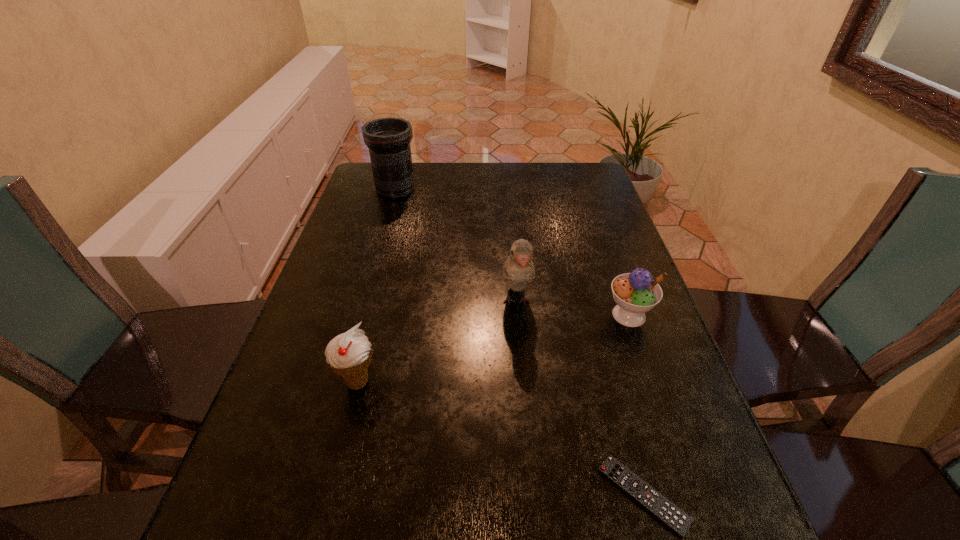
Where is `free space at the left edge of the desktop`? free space at the left edge of the desktop is located at coordinates (297, 379).

You are a GUI agent. You are given a task and a screenshot of the screen. Output one action in this format:
    pyautogui.click(x=<x>, y=<y>)
    Task: Click on the free space at the right edge
    This screenshot has height=540, width=960.
    Given the screenshot: What is the action you would take?
    [x=704, y=534]

The height and width of the screenshot is (540, 960). I want to click on free area in between the farthest object and the remote control, so click(519, 342).

You are a GUI agent. You are given a task and a screenshot of the screen. Output one action in this format:
    pyautogui.click(x=<x>, y=<y>)
    Task: Click on the vacant point located between the remote control and the third object from right to left
    Image resolution: width=960 pixels, height=540 pixels.
    Given the screenshot: What is the action you would take?
    pyautogui.click(x=580, y=399)

At what (x,y) coordinates should I click in order to perform the action: click on free space between the nearest object and the bird. Please return your answer as a coordinate pair (x, y). This screenshot has width=960, height=540. Looking at the image, I should click on (580, 399).

You are a GUI agent. You are given a task and a screenshot of the screen. Output one action in this format:
    pyautogui.click(x=<x>, y=<y>)
    Task: Click on the free point between the bird and the nearest object
    
    Given the screenshot: What is the action you would take?
    pyautogui.click(x=580, y=399)

This screenshot has height=540, width=960. I want to click on unoccupied position between the shorter icecream and the nearest object, so click(636, 405).

Where is `free space between the fourth farthest object and the third object from right to left`? The image size is (960, 540). free space between the fourth farthest object and the third object from right to left is located at coordinates (437, 342).

This screenshot has width=960, height=540. In order to click on vacant space in between the shorter icecream and the third object from right to left in this screenshot , I will do `click(573, 308)`.

Where is `free area in between the nearest object and the telephoto lens`? Image resolution: width=960 pixels, height=540 pixels. free area in between the nearest object and the telephoto lens is located at coordinates (519, 342).